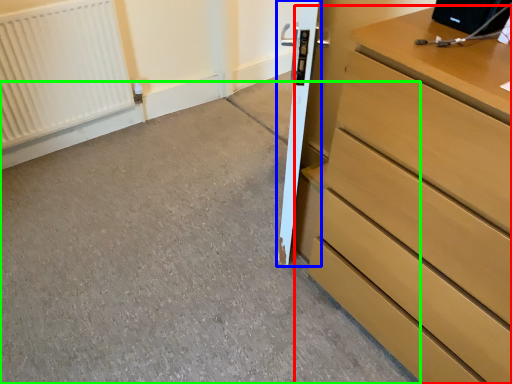
Question: Considering the real-world distances, which object is farthest from chest of drawers (highlighted by a red box)? door (highlighted by a blue box) or concrete (highlighted by a green box)?

Choices:
 (A) door
 (B) concrete

Answer: (B)